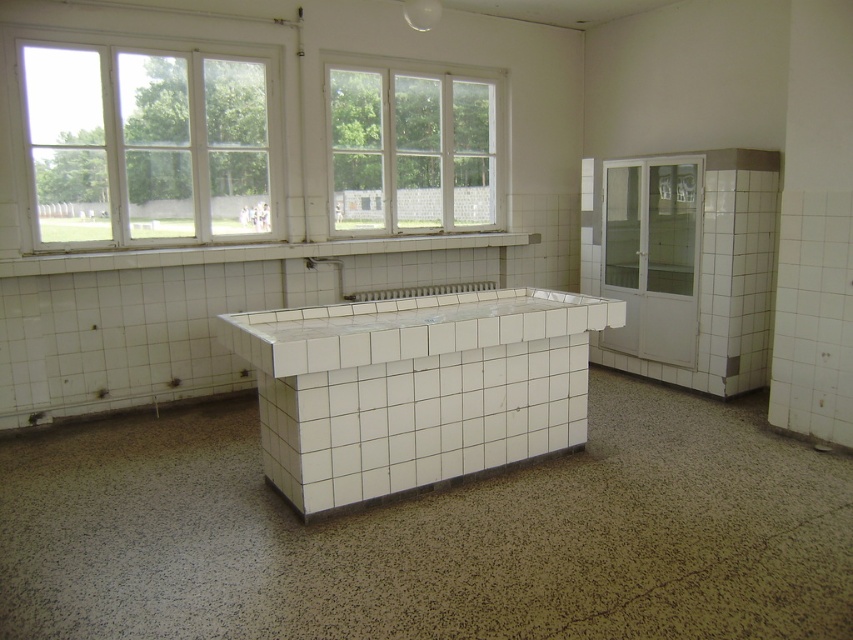
You are a maintenance worker needing to place a 15 cm tall tool on either the white tile counter at center or the white glossy counter top at center. Which surface can accommodate the tool without it being too low to the ground?

The white tile counter at center has a greater height compared to the white glossy counter top at center, so placing the 15 cm tall tool on the white tile counter at center will ensure it is not too low to the ground.

You are standing in the room and want to locate the clear glass window at upper left. According to the coordinates given, where exactly is it positioned?

The clear glass window at upper left is positioned at coordinates point (148, 145).

You are an inspector checking the room layout. You need to determine if the clear glass window at upper left is positioned above the white glossy counter top at center. Based on the scene description, can you confirm this spatial relationship?

Yes, the clear glass window at upper left is located above the white glossy counter top at center according to the description.